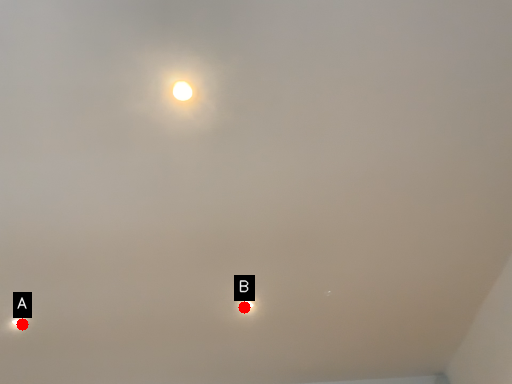
Question: Two points are circled on the image, labeled by A and B beside each circle. Which point is closer to the camera taking this photo?

Choices:
 (A) A is closer
 (B) B is closer

Answer: (B)